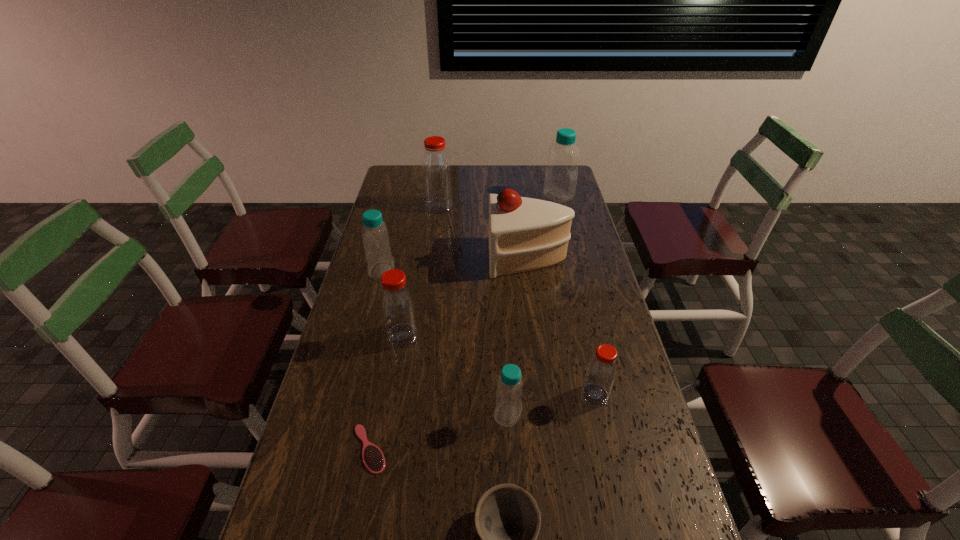
This screenshot has width=960, height=540. I want to click on bottle object that ranks as the closest to the nearest object, so click(x=508, y=409).

Identify which blue bottle is the second closest to the rightmost blue bottle. Please provide its 2D coordinates. Your answer should be formatted as a tuple, i.e. [(x, y)], where the tuple contains the x and y coordinates of a point satisfying the conditions above.

[(508, 409)]

Select which blue bottle appears as the closest to the farthest red bottle. Please provide its 2D coordinates. Your answer should be formatted as a tuple, i.e. [(x, y)], where the tuple contains the x and y coordinates of a point satisfying the conditions above.

[(375, 235)]

Locate an element on the screen. The width and height of the screenshot is (960, 540). red bottle that is the nearest to the second biggest blue bottle is located at coordinates (397, 304).

Select which red bottle is the third closest to the leftmost bottle. Please provide its 2D coordinates. Your answer should be formatted as a tuple, i.e. [(x, y)], where the tuple contains the x and y coordinates of a point satisfying the conditions above.

[(601, 371)]

Where is `vacant region that satisfies the following two spatial constraints: 1. on the front side of the smallest red bottle; 2. on the left side of the second biggest blue bottle`? Image resolution: width=960 pixels, height=540 pixels. vacant region that satisfies the following two spatial constraints: 1. on the front side of the smallest red bottle; 2. on the left side of the second biggest blue bottle is located at coordinates (349, 395).

The height and width of the screenshot is (540, 960). I want to click on vacant position in the image that satisfies the following two spatial constraints: 1. on the back side of the nearest red bottle; 2. on the right side of the fourth bottle from left to right, so click(507, 395).

Where is `free space in the image that satisfies the following two spatial constraints: 1. on the back side of the cake; 2. on the right side of the rightmost blue bottle`? This screenshot has height=540, width=960. free space in the image that satisfies the following two spatial constraints: 1. on the back side of the cake; 2. on the right side of the rightmost blue bottle is located at coordinates (520, 196).